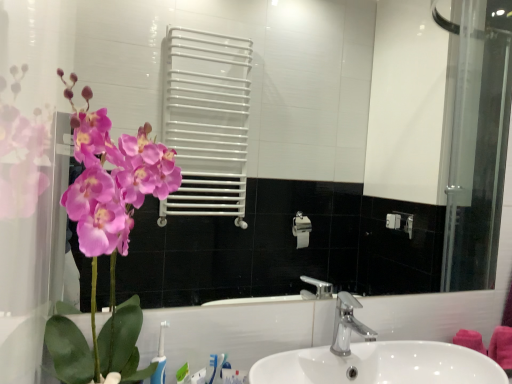
Question: Could you tell me if white glossy sink at center is turned towards silver metallic faucet at center?

Choices:
 (A) no
 (B) yes

Answer: (A)

Question: Considering the relative sizes of white glossy sink at center and silver metallic faucet at center in the image provided, is white glossy sink at center bigger than silver metallic faucet at center?

Choices:
 (A) yes
 (B) no

Answer: (A)

Question: Is white glossy sink at center outside silver metallic faucet at center?

Choices:
 (A) yes
 (B) no

Answer: (A)

Question: Is white glossy sink at center thinner than silver metallic faucet at center?

Choices:
 (A) yes
 (B) no

Answer: (B)

Question: Is white glossy sink at center further to camera compared to silver metallic faucet at center?

Choices:
 (A) no
 (B) yes

Answer: (A)

Question: From a real-world perspective, is white glossy sink at center located higher than silver metallic faucet at center?

Choices:
 (A) yes
 (B) no

Answer: (B)

Question: Are matte pink orchid at left and silver metallic faucet at center far apart?

Choices:
 (A) no
 (B) yes

Answer: (A)

Question: From the image's perspective, does matte pink orchid at left appear higher than silver metallic faucet at center?

Choices:
 (A) yes
 (B) no

Answer: (A)

Question: Does matte pink orchid at left have a lesser height compared to silver metallic faucet at center?

Choices:
 (A) yes
 (B) no

Answer: (B)

Question: Does matte pink orchid at left appear on the left side of silver metallic faucet at center?

Choices:
 (A) yes
 (B) no

Answer: (A)

Question: Considering the relative sizes of matte pink orchid at left and silver metallic faucet at center in the image provided, is matte pink orchid at left thinner than silver metallic faucet at center?

Choices:
 (A) no
 (B) yes

Answer: (A)

Question: Is matte pink orchid at left not inside silver metallic faucet at center?

Choices:
 (A) yes
 (B) no

Answer: (A)

Question: Is there a large distance between silver metallic faucet at center and matte pink orchid at left?

Choices:
 (A) yes
 (B) no

Answer: (B)